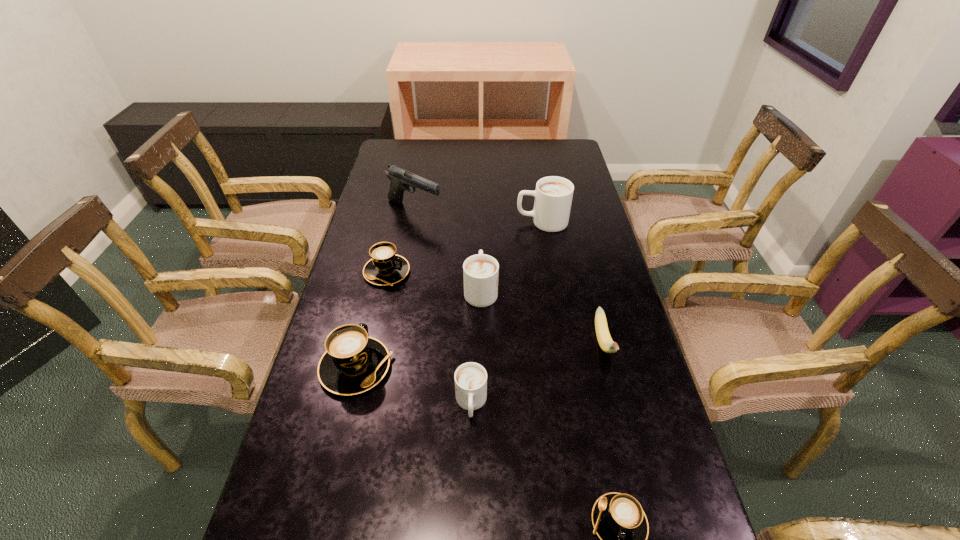
The image size is (960, 540). What are the coordinates of `cappuccino present at the right edge` in the screenshot? It's located at (553, 195).

Where is `banana positioned at the right edge`? banana positioned at the right edge is located at coordinates (605, 341).

Identify the location of vacant space at the far edge of the desktop. (473, 162).

Image resolution: width=960 pixels, height=540 pixels. In the image, there is a desktop. What are the coordinates of `vacant space at the left edge` in the screenshot? It's located at (404, 208).

Find the location of a particular element. The height and width of the screenshot is (540, 960). free space at the right edge of the desktop is located at coordinates (581, 275).

In order to click on blank area at the far left corner in this screenshot , I will do `click(423, 141)`.

Identify the location of free space that is in between the biggest black cappuccino and the nearest white cappuccino. (414, 385).

What are the coordinates of `free area in between the smallest white cappuccino and the banana` in the screenshot? It's located at (538, 373).

Identify the location of free spot between the second biggest white cappuccino and the yellow banana. point(542,316).

The height and width of the screenshot is (540, 960). I want to click on vacant area between the second biggest white cappuccino and the biggest black cappuccino, so click(419, 328).